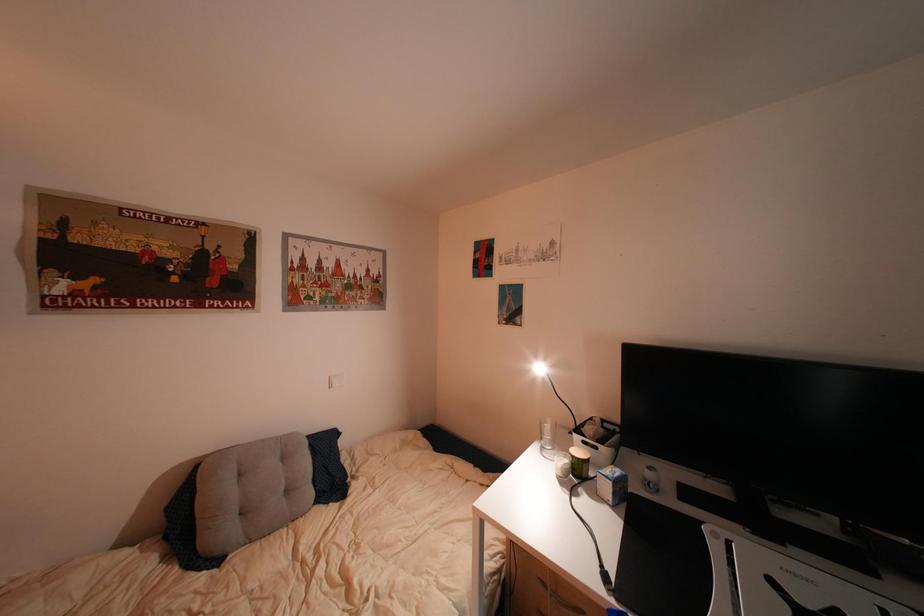
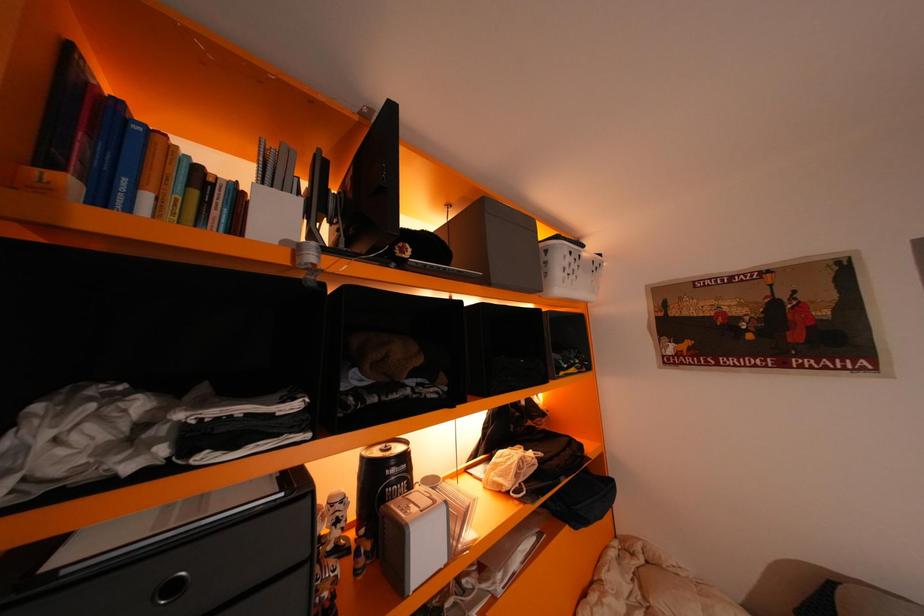
Question: The camera is either moving clockwise (left) or counter-clockwise (right) around the object. The first image is from the beginning of the video and the second image is from the end. Is the camera moving left or right when shooting the video?

Choices:
 (A) Left
 (B) Right

Answer: (B)